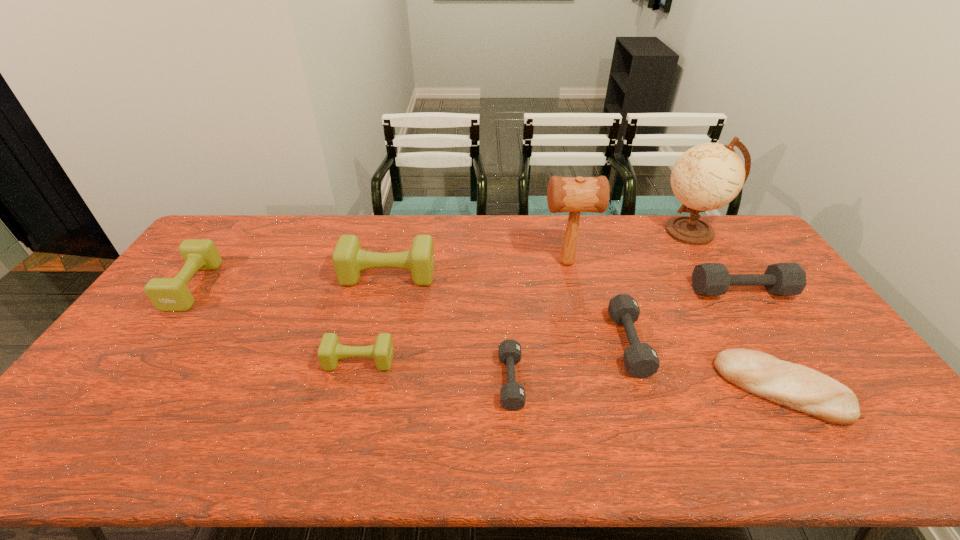
Locate an element on the screen. The width and height of the screenshot is (960, 540). the second gray dumbbell from left to right is located at coordinates (641, 360).

Locate an element on the screen. This screenshot has width=960, height=540. the nearest olive dumbbell is located at coordinates (330, 350).

This screenshot has height=540, width=960. What are the coordinates of `bread` in the screenshot? It's located at (798, 387).

Locate an element on the screen. The height and width of the screenshot is (540, 960). the third dumbbell from right to left is located at coordinates (512, 395).

I want to click on the smallest gray dumbbell, so click(512, 395).

I want to click on vacant space situated on the surface of the beige globe, so click(609, 232).

Find the location of `free space located 0.100m on the surface of the beige globe`. free space located 0.100m on the surface of the beige globe is located at coordinates (630, 232).

Locate an element on the screen. free space located 0.300m on the surface of the beige globe is located at coordinates (576, 232).

I want to click on free space located 0.190m on the strike surface of the mallet, so (x=484, y=263).

Identify the location of vacant area situated 0.270m on the strike surface of the mallet. The width and height of the screenshot is (960, 540). (461, 263).